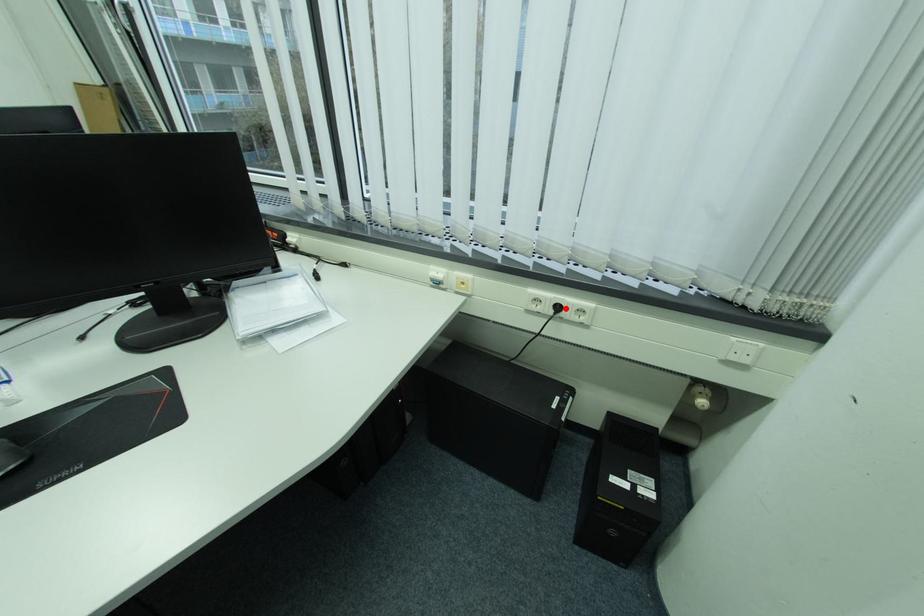
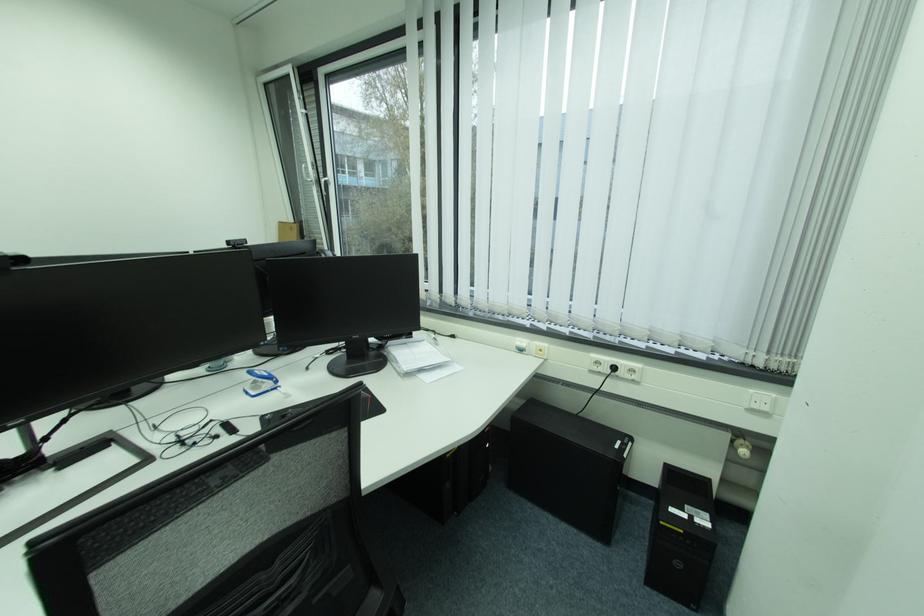
In the second image, find the point that corresponds to the highlighted location in the first image.

(623, 369)